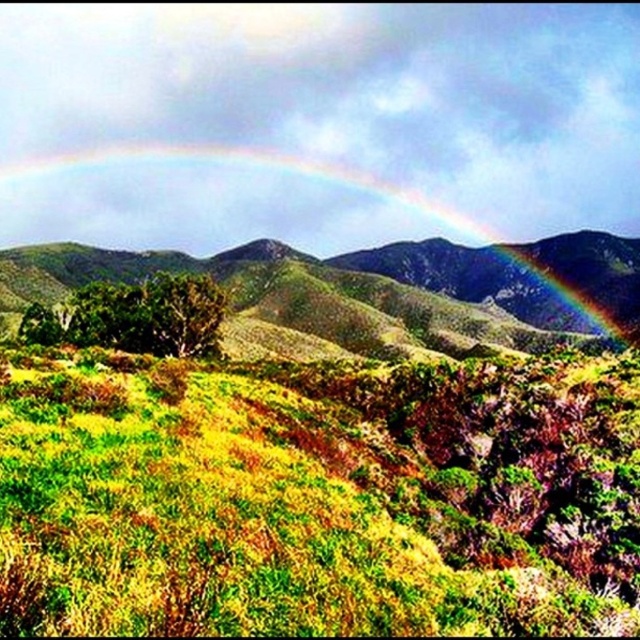
Question: Which point is closer to the camera?

Choices:
 (A) rainbow at upper center
 (B) green grassy at center

Answer: (B)

Question: Can you confirm if green grassy at center is wider than rainbow at upper center?

Choices:
 (A) yes
 (B) no

Answer: (B)

Question: Does green grassy at center have a greater width compared to rainbow at upper center?

Choices:
 (A) no
 (B) yes

Answer: (A)

Question: Observing the image, what is the correct spatial positioning of green grassy at center in reference to rainbow at upper center?

Choices:
 (A) left
 (B) right

Answer: (A)

Question: Which point is farther from the camera taking this photo?

Choices:
 (A) (586, 298)
 (B) (372, 604)

Answer: (A)